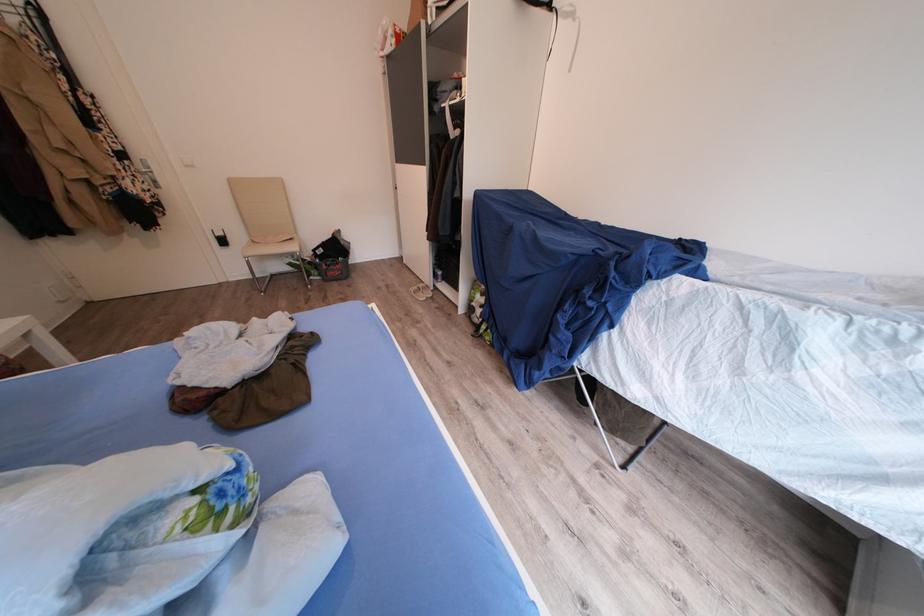
Describe the element at coordinates (146, 171) in the screenshot. The image size is (924, 616). I see `the silver door handle` at that location.